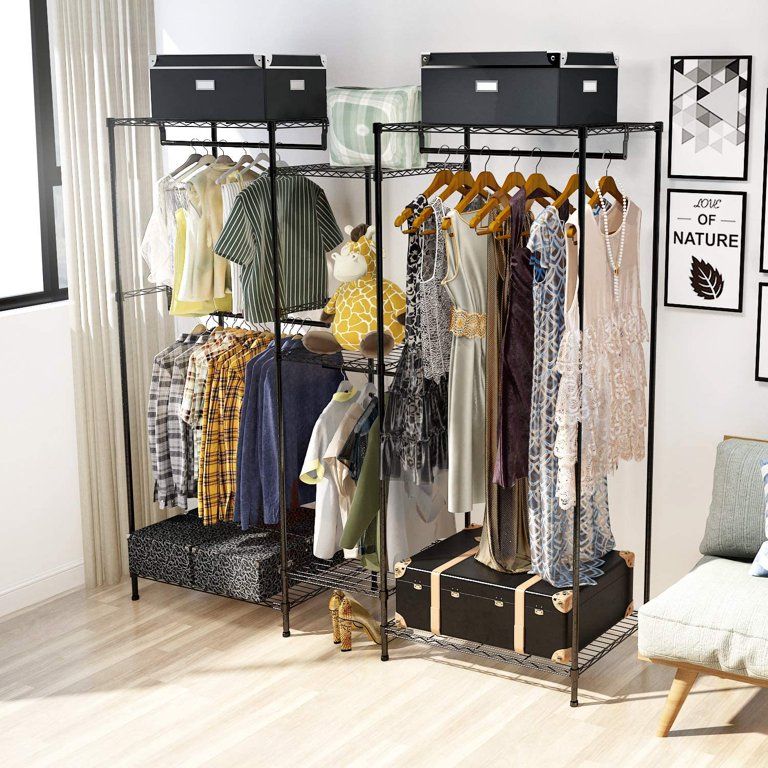
The width and height of the screenshot is (768, 768). What are the coordinates of `shelves` in the screenshot? It's located at (488, 643), (300, 588), (326, 588), (352, 359), (353, 174), (515, 130), (233, 124).